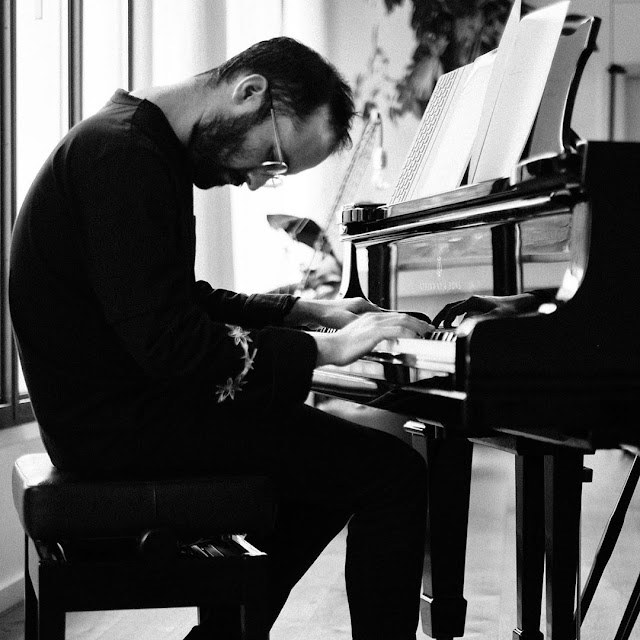
Locate an element on the screen. The height and width of the screenshot is (640, 640). bench is located at coordinates (225, 561).